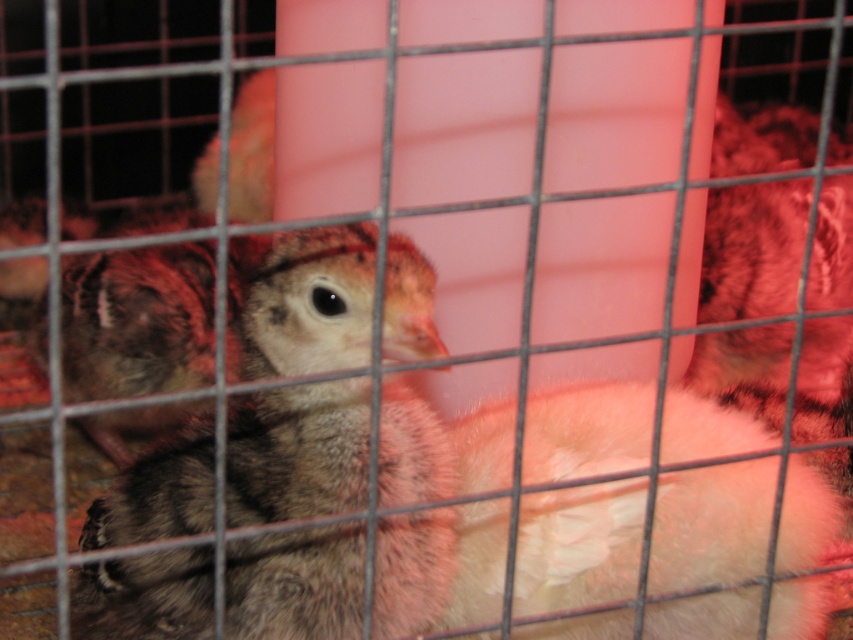
Is speckled feathered chick at center further to the viewer compared to speckled feathered chicken at left?

No, speckled feathered chick at center is in front of speckled feathered chicken at left.

Does speckled feathered chick at center appear on the right side of speckled feathered chicken at left?

Yes, speckled feathered chick at center is to the right of speckled feathered chicken at left.

Is point (125, 634) behind point (196, 340)?

That is False.

This screenshot has height=640, width=853. I want to click on speckled feathered chick at center, so click(x=299, y=452).

Is speckled feathered chick at center to the left of fluffy white chicken at center from the viewer's perspective?

Indeed, speckled feathered chick at center is positioned on the left side of fluffy white chicken at center.

Which is behind, point (381, 632) or point (627, 531)?

The point (627, 531) is more distant.

This screenshot has width=853, height=640. Find the location of `speckled feathered chick at center`. speckled feathered chick at center is located at coordinates (299, 452).

Can you confirm if speckled feathered chick at center is positioned to the left of fluffy brown chicken at center?

Yes, speckled feathered chick at center is to the left of fluffy brown chicken at center.

Can you confirm if speckled feathered chick at center is positioned to the right of fluffy brown chicken at center?

Incorrect, speckled feathered chick at center is not on the right side of fluffy brown chicken at center.

Between point (242, 508) and point (792, 157), which one is positioned behind?

The point (792, 157) is more distant.

Find the location of a particular element. This screenshot has height=640, width=853. speckled feathered chick at center is located at coordinates (299, 452).